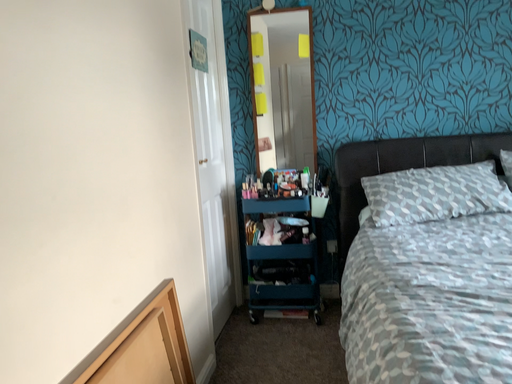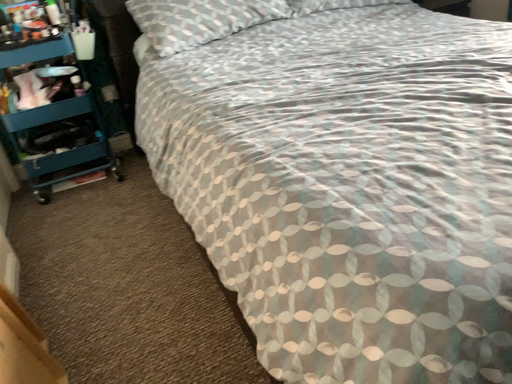
Question: How did the camera likely rotate when shooting the video?

Choices:
 (A) rotated upward
 (B) rotated downward

Answer: (B)